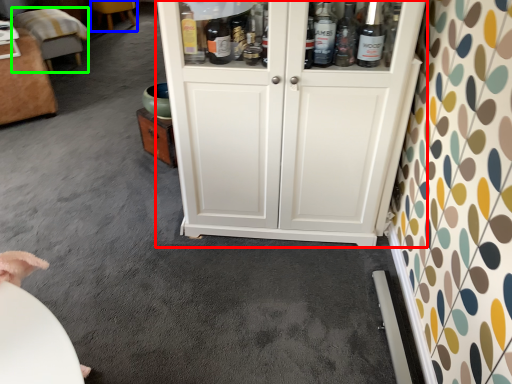
Question: Estimate the real-world distances between objects in this image. Which object is closer to cupboard (highlighted by a red box), furniture (highlighted by a blue box) or furniture (highlighted by a green box)?

Choices:
 (A) furniture
 (B) furniture

Answer: (B)